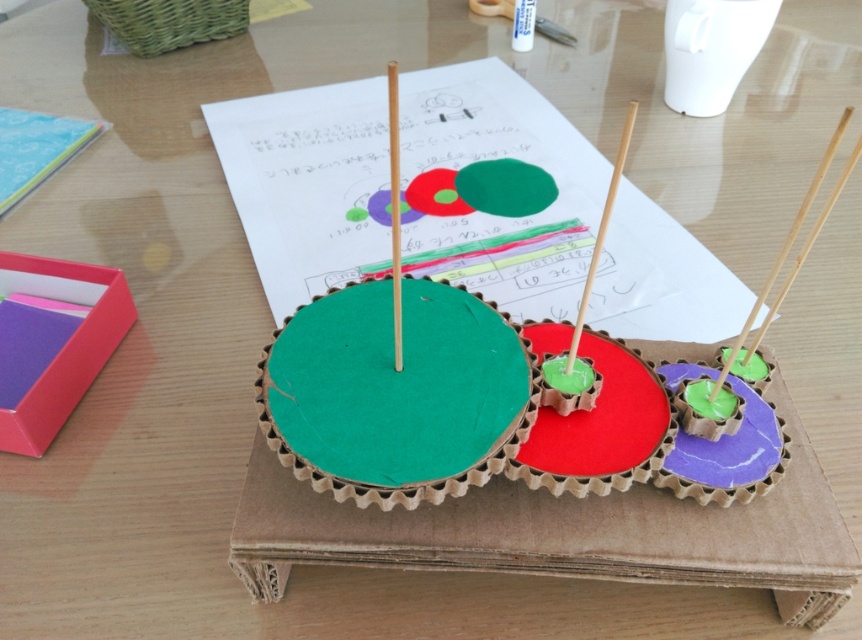
Question: Which point appears closest to the camera in this image?

Choices:
 (A) (610, 188)
 (B) (392, 228)
 (C) (369, 301)

Answer: (A)

Question: Among these objects, which one is nearest to the camera?

Choices:
 (A) wooden stick at center
 (B) smooth wood toothpick at center

Answer: (A)

Question: Can you confirm if green cardboard circle at center is wider than smooth wood toothpick at center?

Choices:
 (A) yes
 (B) no

Answer: (A)

Question: Is wooden stick at center thinner than smooth wood toothpick at center?

Choices:
 (A) no
 (B) yes

Answer: (B)

Question: Estimate the real-world distances between objects in this image. Which object is farther from the smooth wood toothpick at center?

Choices:
 (A) wooden stick at center
 (B) green cardboard circle at center

Answer: (A)

Question: Can you confirm if green cardboard circle at center is thinner than smooth wood toothpick at center?

Choices:
 (A) no
 (B) yes

Answer: (A)